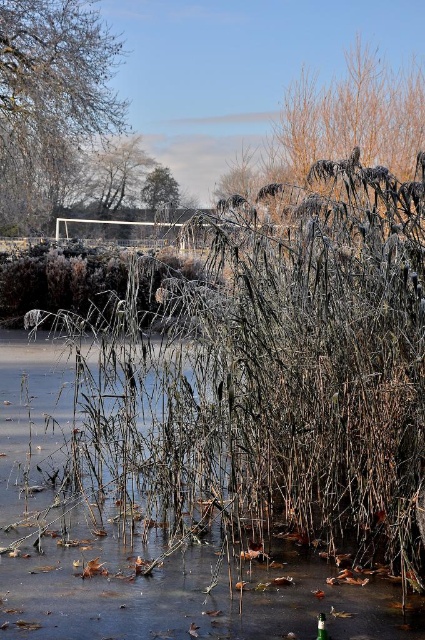
You are an artist sketching the winter scene. You want to draw the brown textured tree at upper center and the green leafy tree at upper center as they appear in the image. Which tree should you draw first to ensure proper layering?

The brown textured tree at upper center should be drawn first because the green leafy tree at upper center is behind it, so the green leafy tree needs to be layered over the brown textured tree to match the scene.

You are an artist trying to paint the winter scene. You want to ensure the proportions between the smooth white tree at upper left and the brown matte bush at center are accurate. Which object should you paint as taller?

The smooth white tree at upper left should be painted as taller since it has a greater height compared to the brown matte bush at center according to the description.

You are an artist sketching this winter scene. You want to ensure the proportions between the smooth white tree at upper left and the brown matte bush at center are accurate. Which object should you draw first to establish the scale, and why?

You should draw the brown matte bush at center first because it has a greater width than the smooth white tree at upper left, making it a better reference point for establishing scale.